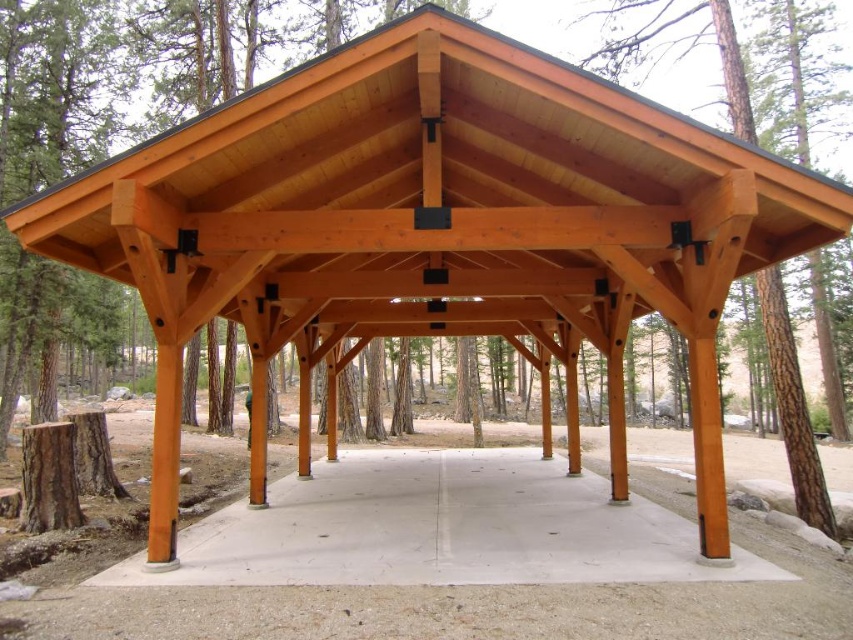
Question: In this image, where is concrete at center located relative to natural wood tree at center?

Choices:
 (A) above
 (B) below

Answer: (B)

Question: Which point appears farthest from the camera in this image?

Choices:
 (A) (839, 388)
 (B) (315, 464)

Answer: (A)

Question: Which object is closer to the camera taking this photo?

Choices:
 (A) natural wood tree at center
 (B) concrete at center

Answer: (B)

Question: From the image, what is the correct spatial relationship of concrete at center in relation to natural wood tree at center?

Choices:
 (A) right
 (B) left

Answer: (B)

Question: Does concrete at center come behind natural wood tree at center?

Choices:
 (A) no
 (B) yes

Answer: (A)